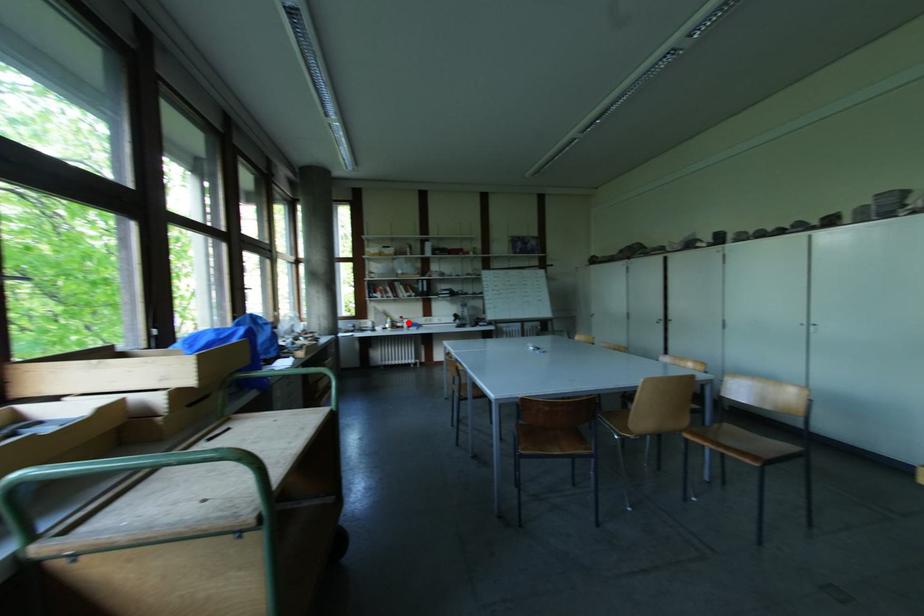
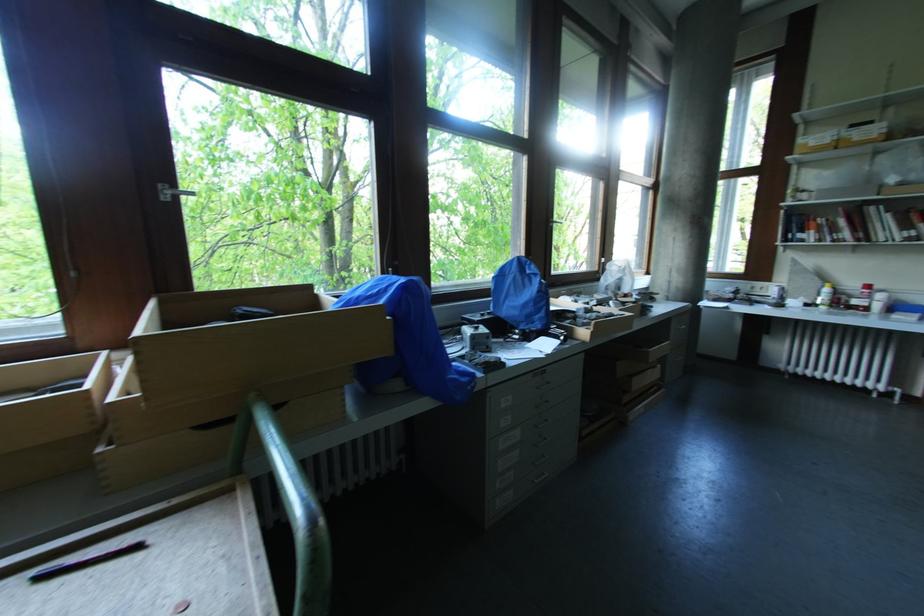
Find the pixel in the second image that matches the highlighted location in the first image.

(882, 298)